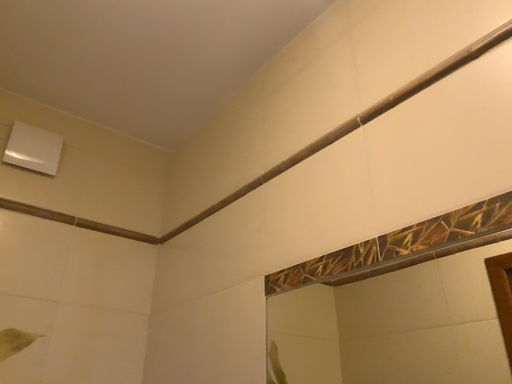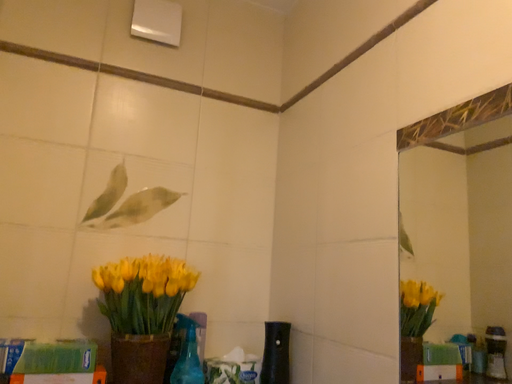
Question: How did the camera likely rotate when shooting the video?

Choices:
 (A) rotated left
 (B) rotated right

Answer: (A)